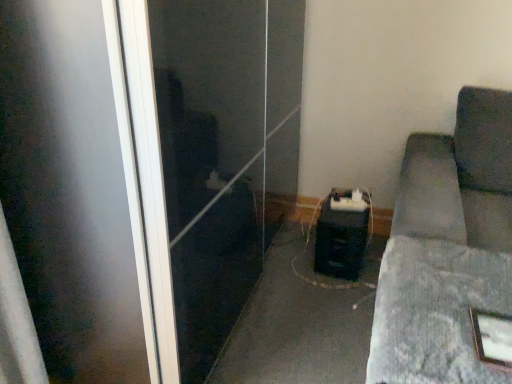
Question: Considering the relative sizes of gray fabric couch at lower right, which is the second concrete from back to front, and wooden picture frame at lower right in the image provided, is gray fabric couch at lower right, which is the second concrete from back to front, shorter than wooden picture frame at lower right?

Choices:
 (A) no
 (B) yes

Answer: (A)

Question: Is gray fabric couch at lower right, the 1th concrete positioned from the front, at the right side of wooden picture frame at lower right?

Choices:
 (A) no
 (B) yes

Answer: (A)

Question: Is wooden picture frame at lower right completely or partially inside gray fabric couch at lower right, the 1th concrete positioned from the front?

Choices:
 (A) yes
 (B) no

Answer: (A)

Question: Could you tell me if gray fabric couch at lower right, which is the second concrete from back to front, is facing wooden picture frame at lower right?

Choices:
 (A) yes
 (B) no

Answer: (A)

Question: From a real-world perspective, is gray fabric couch at lower right, which is the second concrete from back to front, on wooden picture frame at lower right?

Choices:
 (A) yes
 (B) no

Answer: (B)

Question: From the image's perspective, is gray fabric couch at lower right, which is the second concrete from back to front, below wooden picture frame at lower right?

Choices:
 (A) no
 (B) yes

Answer: (A)

Question: Is dark gray fabric couch at right far away from transparent glass screen door at center?

Choices:
 (A) yes
 (B) no

Answer: (B)

Question: Is dark gray fabric couch at right turned away from transparent glass screen door at center?

Choices:
 (A) no
 (B) yes

Answer: (A)

Question: Could you tell me if dark gray fabric couch at right is turned towards transparent glass screen door at center?

Choices:
 (A) yes
 (B) no

Answer: (B)

Question: Is dark gray fabric couch at right shorter than transparent glass screen door at center?

Choices:
 (A) no
 (B) yes

Answer: (B)

Question: Can you confirm if dark gray fabric couch at right is smaller than transparent glass screen door at center?

Choices:
 (A) yes
 (B) no

Answer: (A)

Question: From the image's perspective, does dark gray fabric couch at right appear higher than transparent glass screen door at center?

Choices:
 (A) yes
 (B) no

Answer: (B)

Question: Is gray fabric couch at lower right, the 1th concrete positioned from the front, bigger than black plastic speaker at center, the 2th concrete viewed from the front?

Choices:
 (A) yes
 (B) no

Answer: (B)